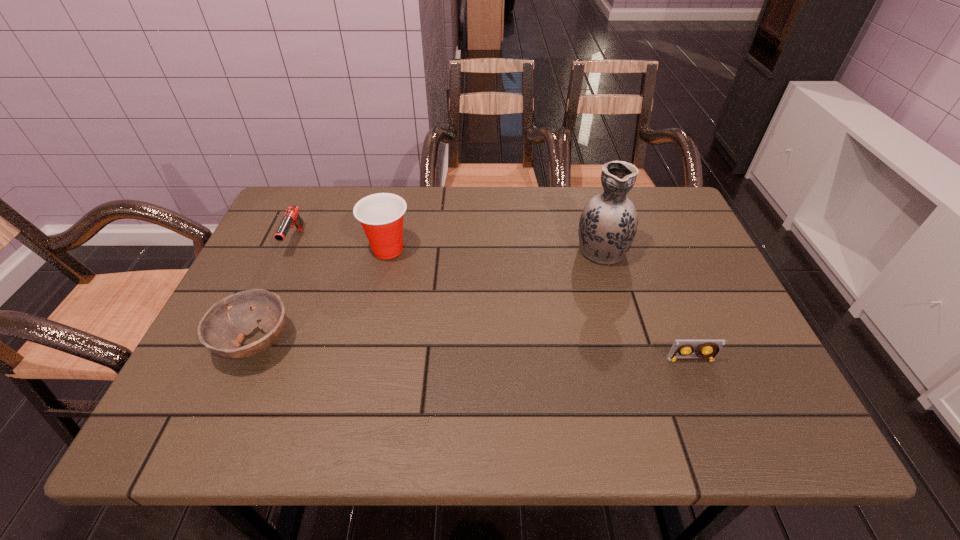
You are a GUI agent. You are given a task and a screenshot of the screen. Output one action in this format:
    pyautogui.click(x=<x>, y=<y>)
    Task: Click on the free space located 0.180m at the aiming end of the gun
    The height and width of the screenshot is (540, 960).
    Given the screenshot: What is the action you would take?
    pyautogui.click(x=264, y=310)

Where is `vacant space located 0.260m on the right of the bowl`? This screenshot has width=960, height=540. vacant space located 0.260m on the right of the bowl is located at coordinates (412, 342).

You are a GUI agent. You are given a task and a screenshot of the screen. Output one action in this format:
    pyautogui.click(x=<x>, y=<y>)
    Task: Click on the free location located 0.160m at the front of the videotape with visible reels
    This screenshot has height=540, width=960.
    Given the screenshot: What is the action you would take?
    pyautogui.click(x=720, y=434)

Image resolution: width=960 pixels, height=540 pixels. I want to click on vase that is at the far edge, so click(x=608, y=223).

You are a GUI agent. You are given a task and a screenshot of the screen. Output one action in this format:
    pyautogui.click(x=<x>, y=<y>)
    Task: Click on the cup located in the far edge section of the desktop
    
    Given the screenshot: What is the action you would take?
    pyautogui.click(x=381, y=215)

This screenshot has height=540, width=960. What are the coordinates of `gun that is at the far edge` in the screenshot? It's located at (291, 217).

Where is `gun that is positioned at the left edge`? Image resolution: width=960 pixels, height=540 pixels. gun that is positioned at the left edge is located at coordinates (291, 217).

Where is `bowl present at the left edge`? The width and height of the screenshot is (960, 540). bowl present at the left edge is located at coordinates (222, 330).

Find the location of a particular element. The image size is (960, 540). object at the right edge is located at coordinates click(707, 350).

Locate an element on the screen. This screenshot has height=540, width=960. object at the far left corner is located at coordinates (291, 217).